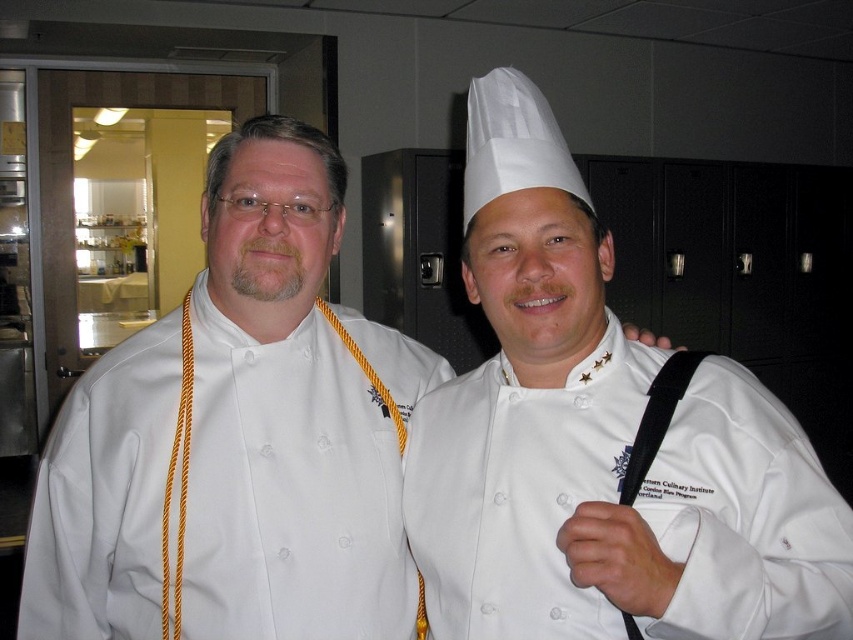
What is the exact coordinate of the white matte chef hat at upper center?

The white matte chef hat at upper center is located at point (599,442).

You are a chef entering the kitchen and need to identify which item is shorter between the white matte chef hat at upper center and the white chef coat at center. Which one should you choose?

The white matte chef hat at upper center is shorter than the white chef coat at center, so you should choose the white matte chef hat at upper center.

You are a chef entering the kitchen and see the white matte chef hat at upper center and the white chef coat at center. Which object is positioned more to the right?

The white matte chef hat at upper center is positioned to the right of the white chef coat at center.